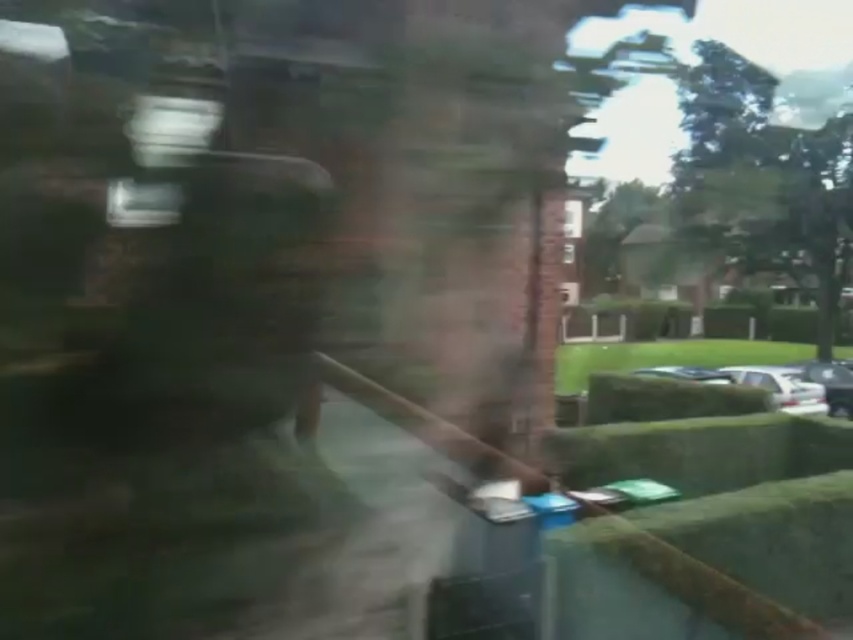
You are a passenger in a moving vehicle and notice two cars outside the window. The white glossy car at lower right and the shiny silver car at center. Which car is located more to the right side of the road?

The white glossy car at lower right is positioned on the right side of the shiny silver car at center, so it is more to the right side of the road.